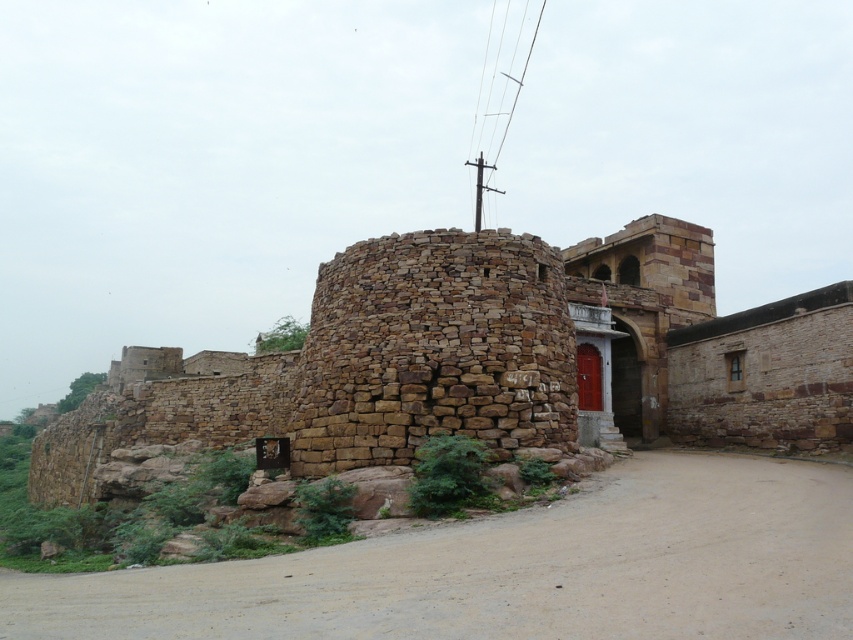
Is brown stone fort at center above brown sandy dirt track at center?

Incorrect, brown stone fort at center is not positioned above brown sandy dirt track at center.

Is point (450, 310) in front of point (339, 634)?

No, (450, 310) is further to viewer.

Who is more distant from viewer, (438, 289) or (469, 580)?

The point (438, 289) is more distant.

Locate an element on the screen. Image resolution: width=853 pixels, height=640 pixels. brown stone fort at center is located at coordinates (486, 360).